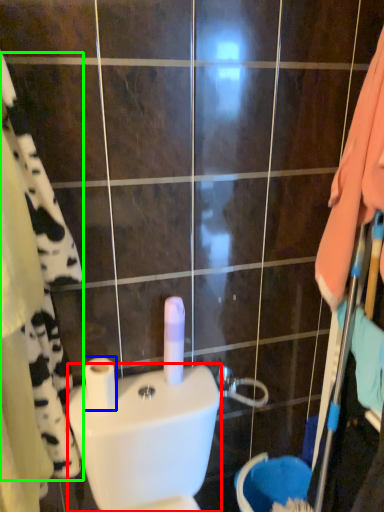
Question: Which object is positioned closest to toilet bowl (highlighted by a red box)? Select from toilet paper (highlighted by a blue box) and bath towel (highlighted by a green box).

Choices:
 (A) toilet paper
 (B) bath towel

Answer: (A)